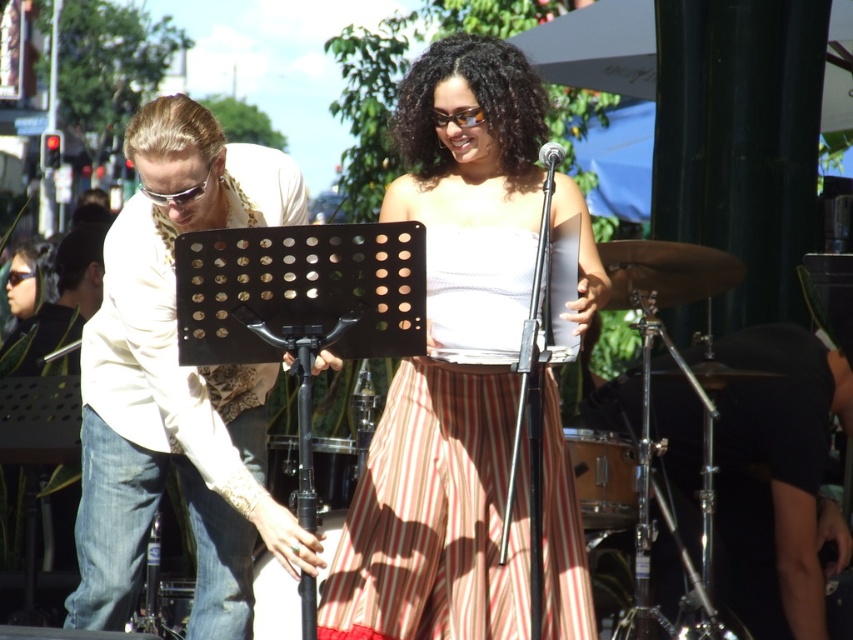
Question: Does white lace shirt at left appear on the right side of wooden drum at center?

Choices:
 (A) yes
 (B) no

Answer: (B)

Question: Which point is farther to the camera?

Choices:
 (A) white lace shirt at left
 (B) white satin dress at center
 (C) wooden drum at center

Answer: (C)

Question: Does white lace shirt at left have a greater width compared to wooden drum at center?

Choices:
 (A) yes
 (B) no

Answer: (A)

Question: Among these points, which one is farthest from the camera?

Choices:
 (A) (x=231, y=509)
 (B) (x=634, y=477)

Answer: (B)

Question: Is white satin dress at center behind wooden drum at center?

Choices:
 (A) no
 (B) yes

Answer: (A)

Question: Which of the following is the farthest from the observer?

Choices:
 (A) white satin dress at center
 (B) wooden drum at center

Answer: (B)